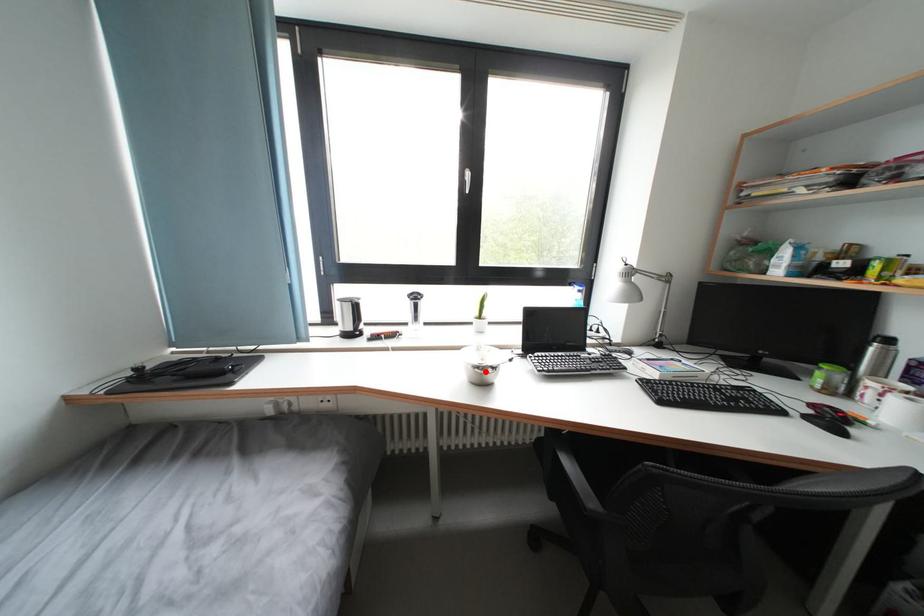
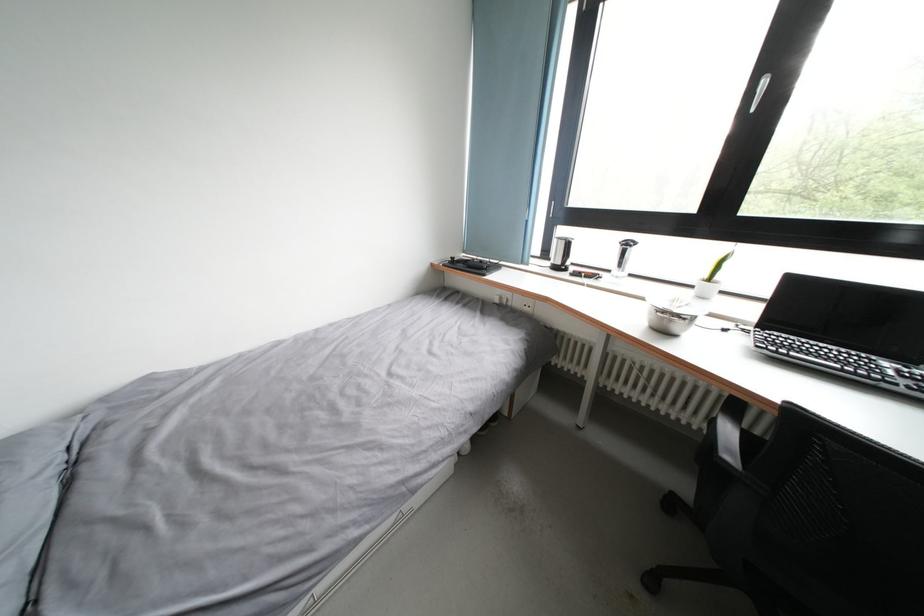
Locate, in the second image, the point that corresponds to the highlighted location in the first image.

(670, 317)